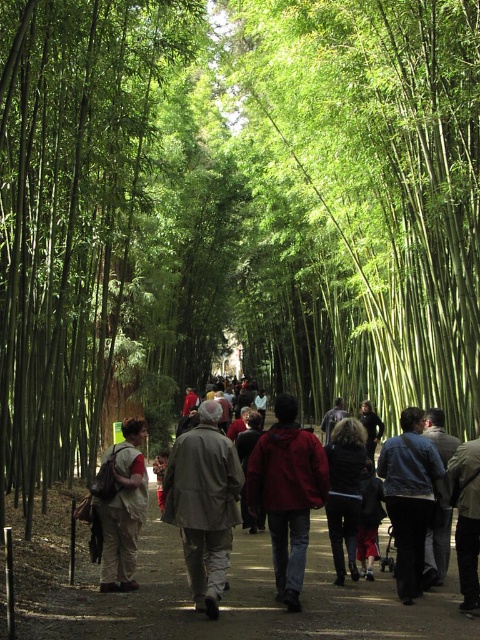
Question: From the image, what is the correct spatial relationship of dark brown fur coat at center in relation to dark brown leather jacket at center?

Choices:
 (A) left
 (B) right

Answer: (A)

Question: From the image, what is the correct spatial relationship of dark brown fur coat at center in relation to dark blue jacket at center?

Choices:
 (A) right
 (B) left

Answer: (B)

Question: Which of these objects is positioned farthest from the dark gray fabric jacket at center?

Choices:
 (A) dark gray jacket at center
 (B) green bamboo at center
 (C) light brown fabric coat at center

Answer: (B)

Question: Which of the following is the farthest from the observer?

Choices:
 (A) (207, 426)
 (B) (351, 561)
 (C) (76, 564)
 (D) (462, 525)

Answer: (C)

Question: Which point is farther to the camera?

Choices:
 (A) (132, 531)
 (B) (467, 476)
 (C) (429, 276)
 (D) (132, 99)

Answer: (C)

Question: Does red matte jacket at center come behind dark blue jacket at center?

Choices:
 (A) no
 (B) yes

Answer: (A)